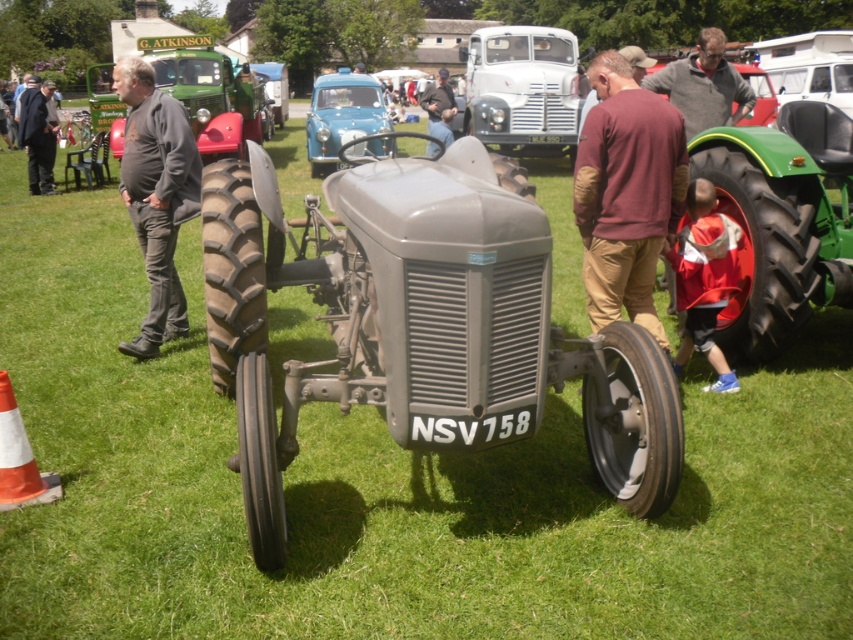
You are standing at the point with coordinates point (x=44, y=193) and want to walk to the point with coordinates point (x=137, y=192). Which direction should you face to walk towards your destination?

You should face north because point (x=137, y=192) is in front of point (x=44, y=193).